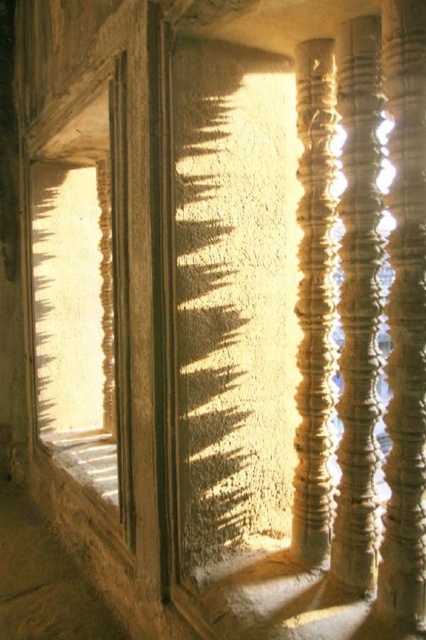
You are an architect examining the temple interior. You notice the matte stone window at left and the white stone window sill at lower left. Which object is located to the left of the other?

The matte stone window at left is positioned on the left side of white stone window sill at lower left.

You are an interior designer planning to install a new decorative element between the matte stone window at left and the smooth stone pillar at right. The decorative element requires a space of 5.5 feet. Based on the scene, will there be enough space?

The matte stone window at left is 6.07 feet from the smooth stone pillar at right, so there is sufficient space to install the decorative element requiring 5.5 feet.

You are standing in the temple and want to locate the point marked at coordinates (75, 292). Based on the scene description, which object does this point belong to?

The point marked at coordinates (75, 292) is on the matte stone window at left.